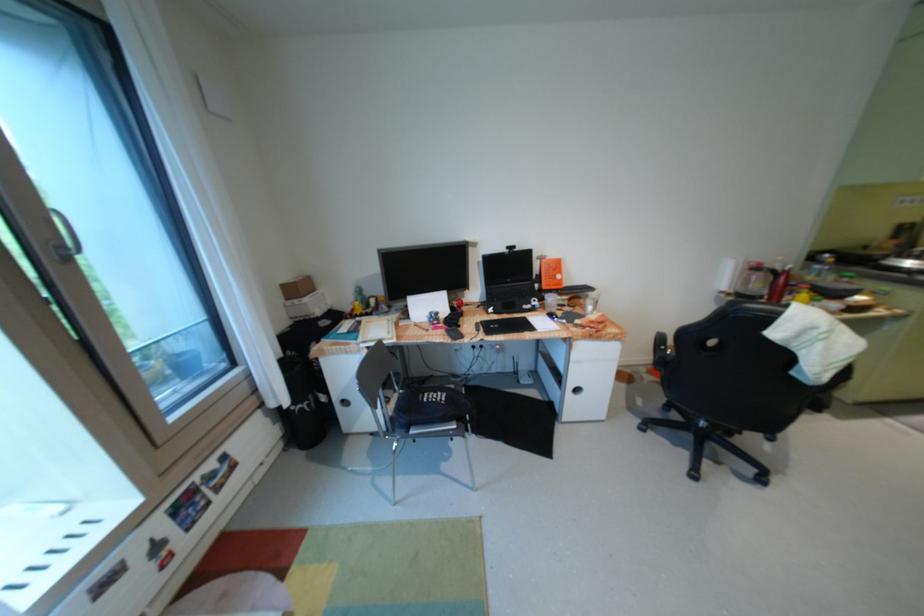
Locate an element on the screen. black chair armrest is located at coordinates (660, 351).